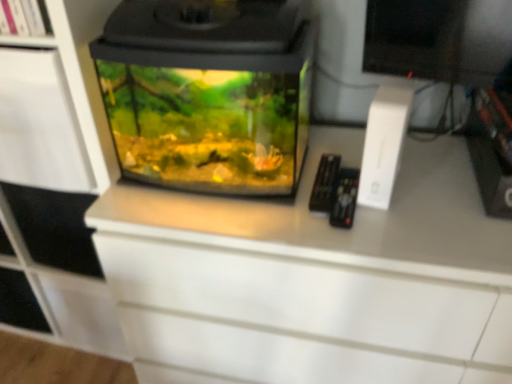
Question: Is transparent glass aquarium at center a part of white matte shelf at upper left?

Choices:
 (A) no
 (B) yes

Answer: (A)

Question: From the image's perspective, is white matte shelf at upper left over transparent glass aquarium at center?

Choices:
 (A) no
 (B) yes

Answer: (B)

Question: Does white matte shelf at upper left have a lesser width compared to transparent glass aquarium at center?

Choices:
 (A) no
 (B) yes

Answer: (B)

Question: Is white matte shelf at upper left facing towards transparent glass aquarium at center?

Choices:
 (A) yes
 (B) no

Answer: (B)

Question: From the image's perspective, would you say white matte shelf at upper left is shown under transparent glass aquarium at center?

Choices:
 (A) no
 (B) yes

Answer: (A)

Question: Is transparent glass aquarium at center at the back of white matte shelf at upper left?

Choices:
 (A) yes
 (B) no

Answer: (B)

Question: Is transparent glass aquarium at center with white matte shelf at upper left?

Choices:
 (A) yes
 (B) no

Answer: (B)

Question: Can you confirm if transparent glass aquarium at center is shorter than white matte shelf at upper left?

Choices:
 (A) no
 (B) yes

Answer: (A)

Question: Considering the relative sizes of transparent glass aquarium at center and white matte shelf at upper left in the image provided, is transparent glass aquarium at center wider than white matte shelf at upper left?

Choices:
 (A) no
 (B) yes

Answer: (B)

Question: Is transparent glass aquarium at center oriented away from white matte shelf at upper left?

Choices:
 (A) yes
 (B) no

Answer: (B)

Question: Would you say transparent glass aquarium at center contains white matte shelf at upper left?

Choices:
 (A) no
 (B) yes

Answer: (A)

Question: Considering the relative sizes of transparent glass aquarium at center and white matte shelf at upper left in the image provided, is transparent glass aquarium at center smaller than white matte shelf at upper left?

Choices:
 (A) no
 (B) yes

Answer: (A)

Question: From the image's perspective, is white matte cabinet at left over white matte shelf at upper left?

Choices:
 (A) no
 (B) yes

Answer: (A)